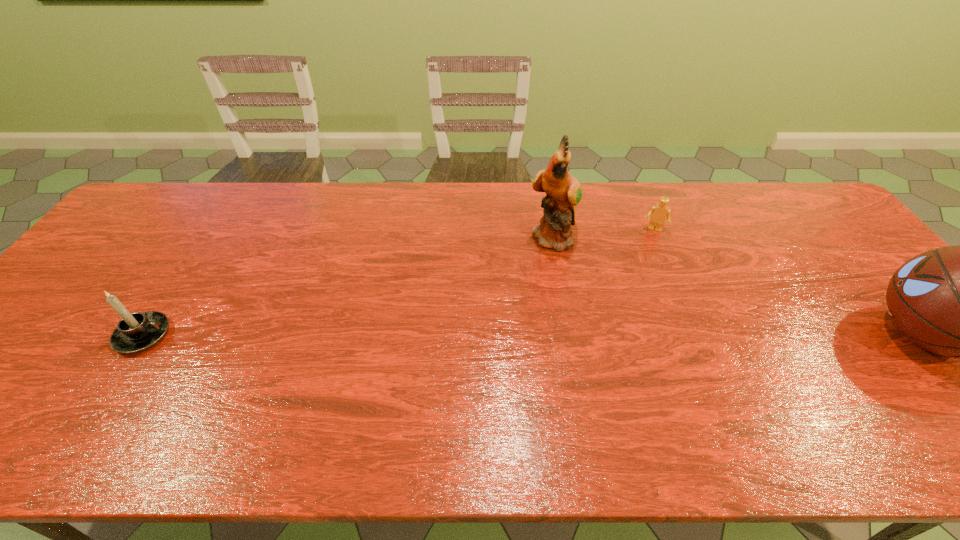
Identify the location of vacant space at the near left corner of the desktop. (11, 376).

Locate an element on the screen. Image resolution: width=960 pixels, height=540 pixels. free space at the far right corner of the desktop is located at coordinates (790, 227).

Where is `empty space that is in between the third object from left to right and the leftmost object`? The width and height of the screenshot is (960, 540). empty space that is in between the third object from left to right and the leftmost object is located at coordinates (398, 282).

The height and width of the screenshot is (540, 960). What are the coordinates of `vacant space in between the tallest object and the second object from right to left` in the screenshot? It's located at (603, 234).

Where is `vacant space in between the third object from left to right and the third object from right to left`? vacant space in between the third object from left to right and the third object from right to left is located at coordinates (603, 234).

Where is `free space that is in between the second object from right to left and the second shortest object`? The height and width of the screenshot is (540, 960). free space that is in between the second object from right to left and the second shortest object is located at coordinates (398, 282).

Find the location of a particular element. This screenshot has height=540, width=960. empty location between the Lego and the candle holder is located at coordinates (398, 282).

At what (x,y) coordinates should I click in order to perform the action: click on object that is the closest to the second object from left to right. Please return your answer as a coordinate pair (x, y). Looking at the image, I should click on (658, 213).

The image size is (960, 540). In order to click on object that is the nearest to the Lego in this screenshot , I will do (563, 192).